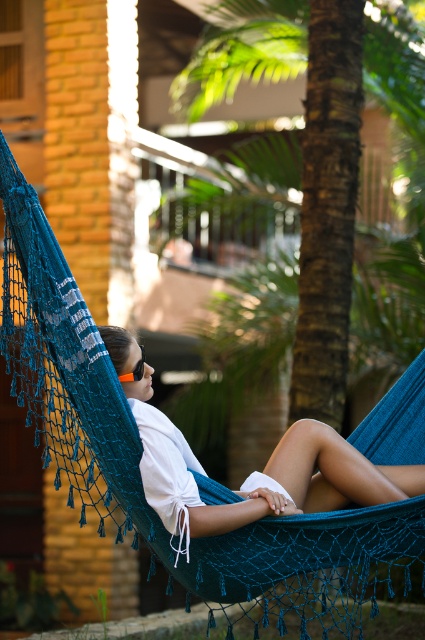
How distant is green textured palm tree at center from orange foam goggles at center?

green textured palm tree at center is 4.91 meters away from orange foam goggles at center.

Which is in front, point (325, 72) or point (124, 376)?

Positioned in front is point (124, 376).

I want to click on green textured palm tree at center, so click(x=317, y=144).

Can you confirm if white cotton shirt at center is smaller than orange foam goggles at center?

No, white cotton shirt at center is not smaller than orange foam goggles at center.

Does white cotton shirt at center appear over orange foam goggles at center?

Actually, white cotton shirt at center is below orange foam goggles at center.

Who is more forward, [291,480] or [138,374]?

Point [138,374]

Where is `white cotton shirt at center`? This screenshot has width=425, height=640. white cotton shirt at center is located at coordinates (309, 481).

Which of these two, green textured palm tree at center or white cotton shirt at center, stands taller?

green textured palm tree at center

Locate an element on the screen. Image resolution: width=425 pixels, height=640 pixels. green textured palm tree at center is located at coordinates (317, 144).